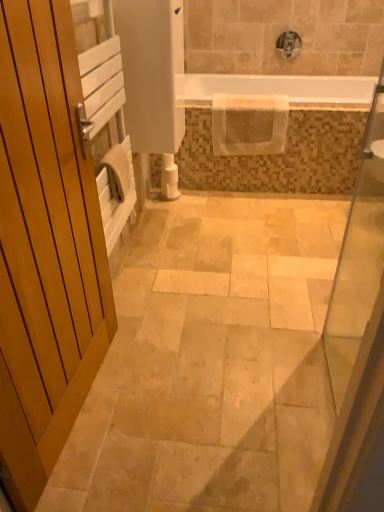
Question: Is white textured towel at center far away from wooden door at left?

Choices:
 (A) no
 (B) yes

Answer: (B)

Question: Is white textured towel at center thinner than wooden door at left?

Choices:
 (A) no
 (B) yes

Answer: (A)

Question: Considering the relative sizes of white textured towel at center and wooden door at left in the image provided, is white textured towel at center bigger than wooden door at left?

Choices:
 (A) yes
 (B) no

Answer: (B)

Question: Is white textured towel at center further to camera compared to wooden door at left?

Choices:
 (A) yes
 (B) no

Answer: (A)

Question: Is white textured towel at center at the left side of wooden door at left?

Choices:
 (A) no
 (B) yes

Answer: (A)

Question: From a real-world perspective, is white textured towel at center positioned over wooden door at left based on gravity?

Choices:
 (A) yes
 (B) no

Answer: (B)

Question: From a real-world perspective, is satin nickel faucet at upper center under white matte toilet paper at center?

Choices:
 (A) no
 (B) yes

Answer: (A)

Question: Is white matte toilet paper at center surrounded by satin nickel faucet at upper center?

Choices:
 (A) no
 (B) yes

Answer: (A)

Question: Does satin nickel faucet at upper center have a lesser height compared to white matte toilet paper at center?

Choices:
 (A) yes
 (B) no

Answer: (A)

Question: Is satin nickel faucet at upper center placed right next to white matte toilet paper at center?

Choices:
 (A) yes
 (B) no

Answer: (B)

Question: From the image's perspective, does satin nickel faucet at upper center appear lower than white matte toilet paper at center?

Choices:
 (A) yes
 (B) no

Answer: (B)

Question: Is satin nickel faucet at upper center at the right side of white matte toilet paper at center?

Choices:
 (A) no
 (B) yes

Answer: (B)

Question: Is white matte toilet paper at center aimed at white textured towel at upper center?

Choices:
 (A) yes
 (B) no

Answer: (B)